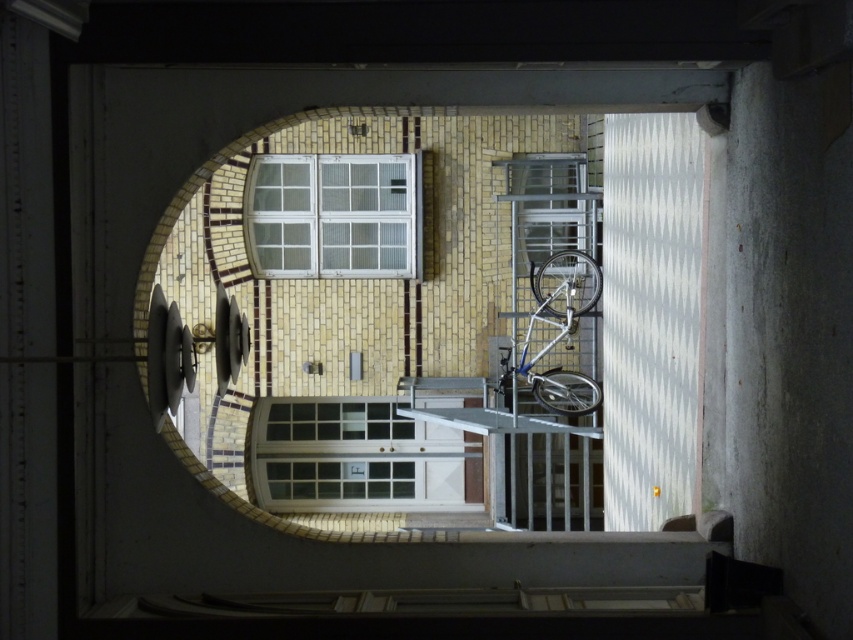
Is white glass door at center bigger than silver metallic bicycle at center?

Yes.

Does white glass door at center appear on the right side of silver metallic bicycle at center?

Incorrect, white glass door at center is not on the right side of silver metallic bicycle at center.

The width and height of the screenshot is (853, 640). What do you see at coordinates (357, 458) in the screenshot?
I see `white glass door at center` at bounding box center [357, 458].

Where is `white glass door at center`? white glass door at center is located at coordinates (357, 458).

From the picture: Is yellow brick archway at center taller than white glass window at upper center?

Indeed, yellow brick archway at center has a greater height compared to white glass window at upper center.

Is yellow brick archway at center below white glass window at upper center?

Correct, yellow brick archway at center is located below white glass window at upper center.

Describe the element at coordinates (451, 323) in the screenshot. I see `yellow brick archway at center` at that location.

What are the coordinates of `yellow brick archway at center` in the screenshot? It's located at 451,323.

In the scene shown: Between white glass door at center and white glass window at upper center, which one has more height?

Standing taller between the two is white glass door at center.

Is point (442, 433) closer to camera compared to point (257, 177)?

No, it is not.

Between point (331, 429) and point (294, 260), which one is positioned in front?

Point (294, 260)

Identify the location of white glass door at center. This screenshot has height=640, width=853. (357, 458).